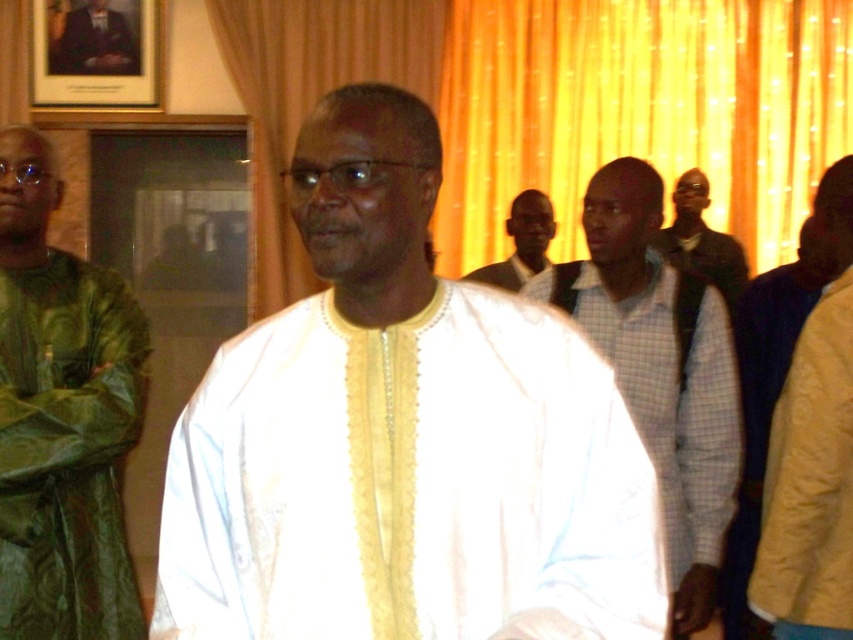
Which is behind, point (112, 72) or point (523, 196)?

The point (112, 72) is more distant.

Is point (70, 67) closer to camera compared to point (517, 262)?

No, it is behind (517, 262).

The image size is (853, 640). I want to click on matte black suit at upper left, so click(96, 42).

Does yellow textured robe at right have a lesser width compared to white textured robe at center?

Correct, yellow textured robe at right's width is less than white textured robe at center's.

Can you confirm if yellow textured robe at right is positioned to the left of white textured robe at center?

No, yellow textured robe at right is not to the left of white textured robe at center.

Does point (843, 428) come closer to viewer compared to point (544, 266)?

Yes, point (843, 428) is in front of point (544, 266).

I want to click on yellow textured robe at right, so click(x=810, y=483).

Between point (691, 266) and point (119, 48), which one is positioned behind?

The point (119, 48) is behind.

Does point (675, 236) come in front of point (80, 52)?

No, it is behind (80, 52).

Identify the location of dark brown leather jacket at right. (701, 241).